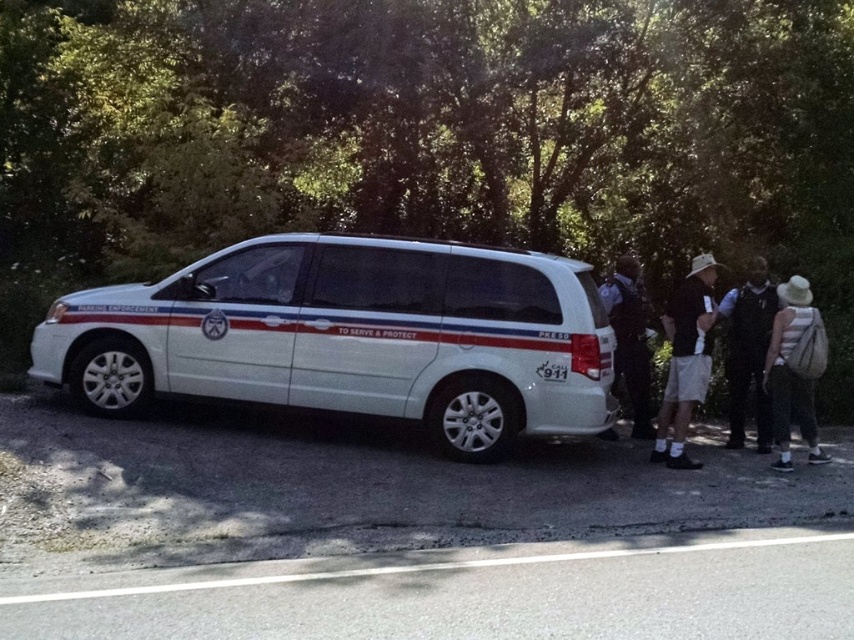
Question: Observing the image, what is the correct spatial positioning of white glossy minivan at center in reference to black uniform at right?

Choices:
 (A) below
 (B) above

Answer: (B)

Question: Which object is closer to the camera taking this photo?

Choices:
 (A) white glossy minivan at center
 (B) white striped shirt at right
 (C) khaki shorts at right
 (D) black uniform at right

Answer: (A)

Question: Which object is farther from the camera taking this photo?

Choices:
 (A) white glossy minivan at center
 (B) black uniform at right
 (C) khaki shorts at right
 (D) dark blue uniform at center

Answer: (D)

Question: Which point is closer to the camera?

Choices:
 (A) white glossy minivan at center
 (B) dark blue uniform at center
 (C) white striped shirt at right
 (D) khaki shorts at right

Answer: (A)

Question: Considering the relative positions of white glossy minivan at center and khaki shorts at right in the image provided, where is white glossy minivan at center located with respect to khaki shorts at right?

Choices:
 (A) above
 (B) below

Answer: (A)

Question: Does white glossy minivan at center have a larger size compared to black uniform at right?

Choices:
 (A) yes
 (B) no

Answer: (A)